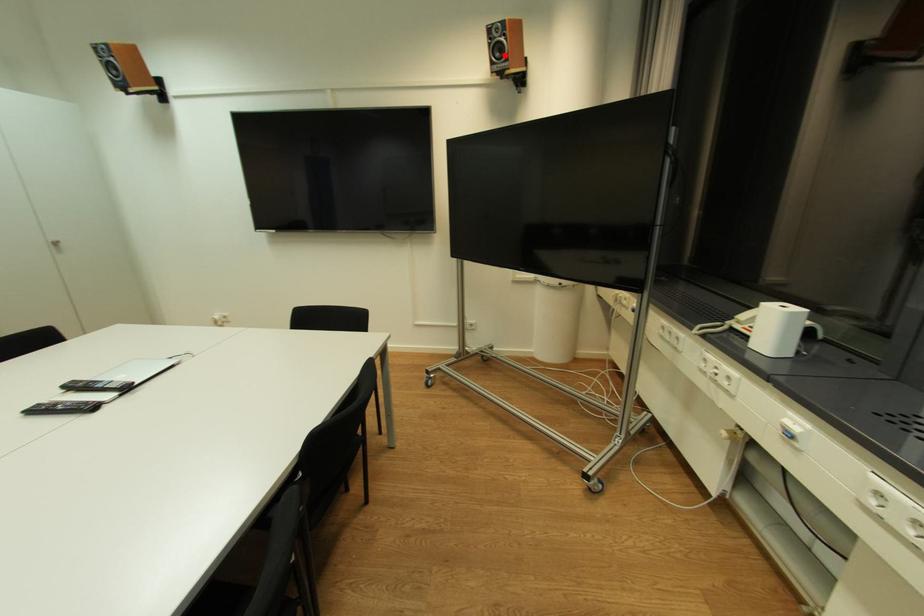
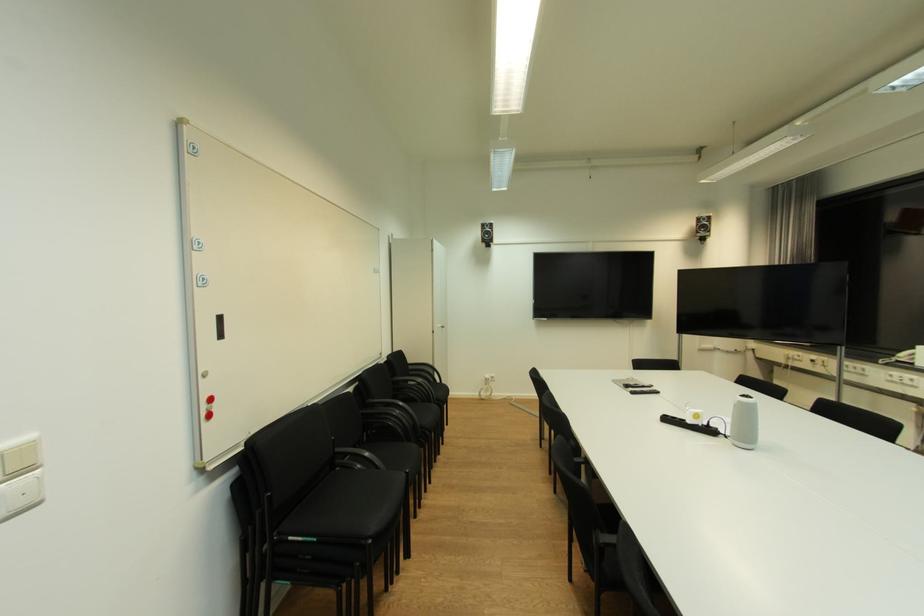
The point at the highlighted location is marked in the first image. Where is the corresponding point in the second image?

(708, 231)